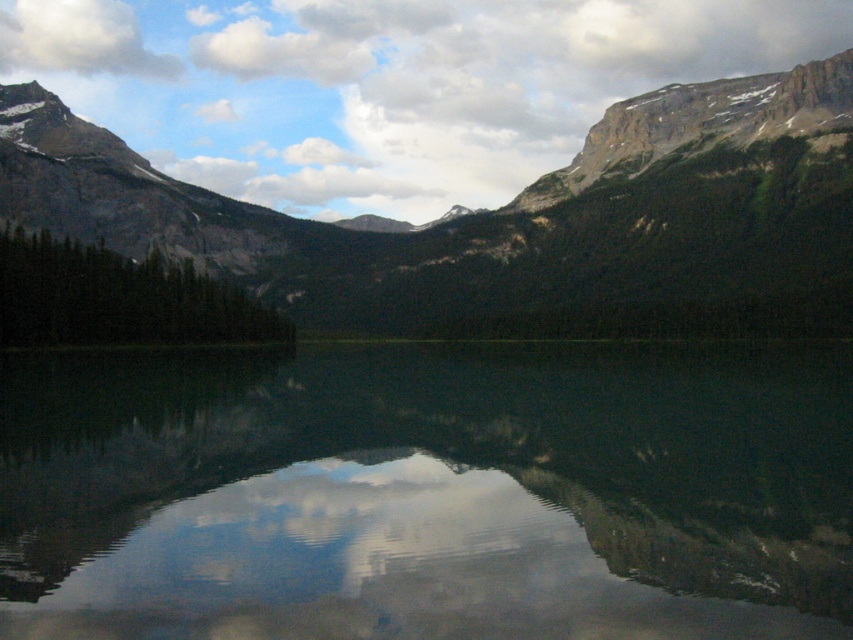
Is transparent glass water at center smaller than rocky mountain range at center?

Indeed, transparent glass water at center has a smaller size compared to rocky mountain range at center.

Locate an element on the screen. The height and width of the screenshot is (640, 853). transparent glass water at center is located at coordinates (428, 492).

The height and width of the screenshot is (640, 853). I want to click on transparent glass water at center, so click(x=428, y=492).

Identify the location of transparent glass water at center. (428, 492).

Between transparent glass water at center and white fluffy cloud at upper left, which one appears on the right side from the viewer's perspective?

transparent glass water at center

Which is above, transparent glass water at center or white fluffy cloud at upper left?

white fluffy cloud at upper left

Image resolution: width=853 pixels, height=640 pixels. I want to click on transparent glass water at center, so click(428, 492).

Can you confirm if rocky mountain range at center is positioned below white fluffy cloud at upper left?

Yes, rocky mountain range at center is below white fluffy cloud at upper left.

Based on the photo, between rocky mountain range at center and white fluffy cloud at upper left, which one appears on the right side from the viewer's perspective?

rocky mountain range at center is more to the right.

Does point (602, 304) come farther from viewer compared to point (119, 54)?

No, it is in front of (119, 54).

Locate an element on the screen. The height and width of the screenshot is (640, 853). rocky mountain range at center is located at coordinates (512, 221).